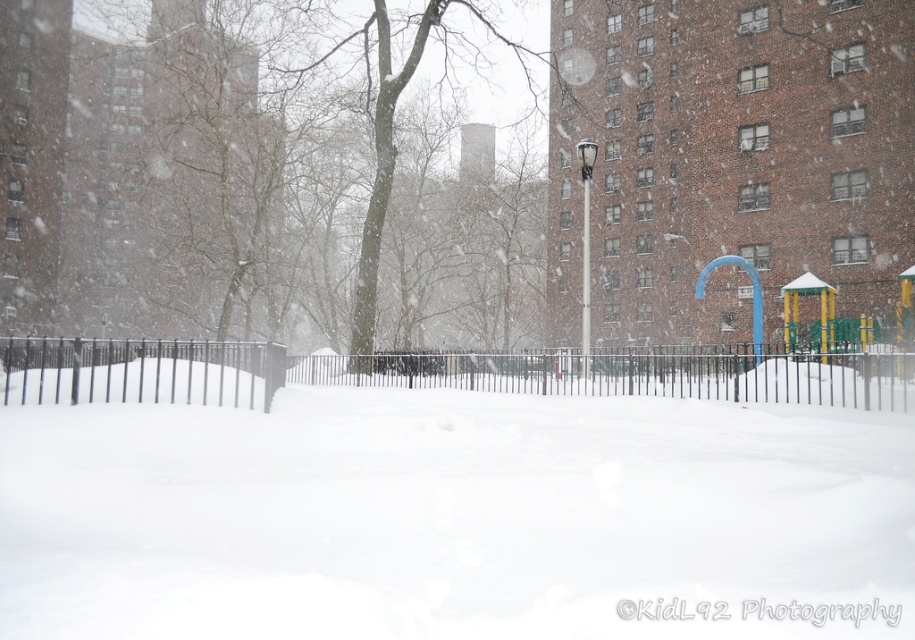
Question: Considering the relative positions of white fluffy snow at center and black metal fence at center in the image provided, where is white fluffy snow at center located with respect to black metal fence at center?

Choices:
 (A) right
 (B) left

Answer: (A)

Question: Does white fluffy snow at center have a lesser width compared to black metal fence at center?

Choices:
 (A) no
 (B) yes

Answer: (A)

Question: From the image, what is the correct spatial relationship of white fluffy snow at center in relation to black metal fence at center?

Choices:
 (A) below
 (B) above

Answer: (B)